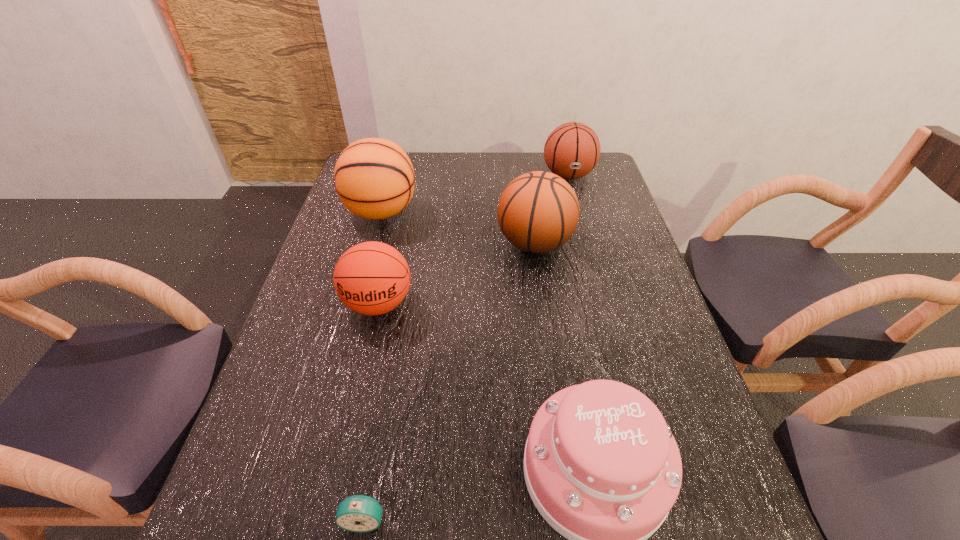
This screenshot has width=960, height=540. Find the location of `the farthest basketball`. the farthest basketball is located at coordinates (572, 150).

This screenshot has height=540, width=960. What are the coordinates of `the nearest basketball` in the screenshot? It's located at (371, 278).

Where is `alarm clock`? This screenshot has height=540, width=960. alarm clock is located at coordinates (358, 513).

In order to click on vacant space located on the side where the inflation valve is located in this screenshot , I will do `click(586, 238)`.

You are a GUI agent. You are given a task and a screenshot of the screen. Output one action in this format:
    pyautogui.click(x=<x>, y=<y>)
    Task: Click on the vacant space located on the side with logo of the third nearest object
    
    Given the screenshot: What is the action you would take?
    pyautogui.click(x=356, y=401)

I want to click on object that is at the far edge, so click(x=572, y=150).

Locate an element on the screen. The height and width of the screenshot is (540, 960). object present at the near edge is located at coordinates (358, 513).

Locate an element on the screen. object that is positioned at the right edge is located at coordinates (572, 150).

The image size is (960, 540). I want to click on object that is positioned at the far right corner, so click(x=572, y=150).

In the image, there is a desktop. Where is `vacant area at the far edge`? Image resolution: width=960 pixels, height=540 pixels. vacant area at the far edge is located at coordinates (417, 161).